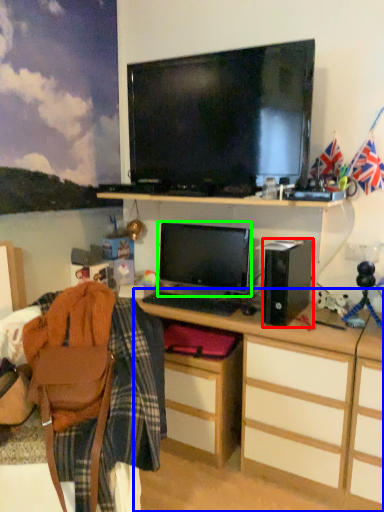
Question: Which object is positioned closest to speaker (highlighted by a red box)? Select from desk (highlighted by a blue box) and computer monitor (highlighted by a green box).

Choices:
 (A) desk
 (B) computer monitor

Answer: (B)